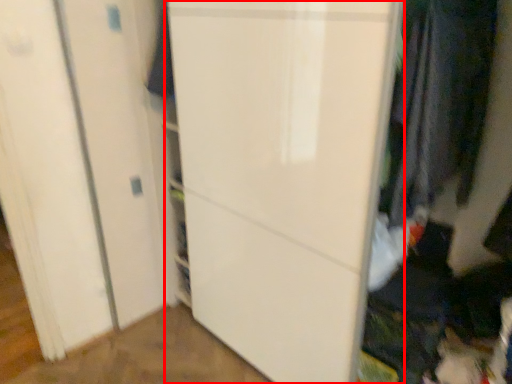
Question: From the image's perspective, considering the relative positions of door (annotated by the red box) and clothing in the image provided, where is door (annotated by the red box) located with respect to the staircase?

Choices:
 (A) above
 (B) below

Answer: (B)